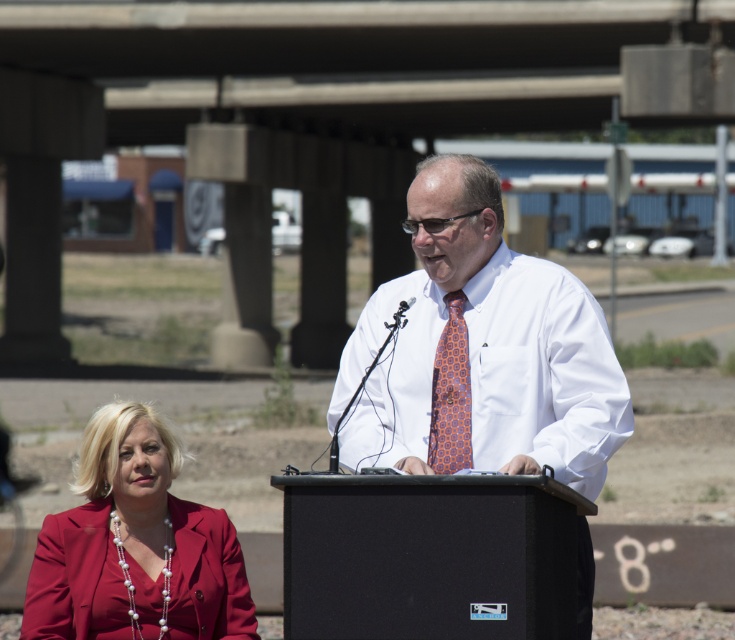
Question: Which is nearer to the concrete at center?

Choices:
 (A) black plastic speaker at center
 (B) orange hexagonal tie at center
 (C) white woven dress shirt at center
 (D) matte red blazer at lower left

Answer: (A)

Question: Estimate the real-world distances between objects in this image. Which object is farther from the concrete at center?

Choices:
 (A) white woven dress shirt at center
 (B) matte red blazer at lower left
 (C) black plastic speaker at center

Answer: (A)

Question: Is black plastic speaker at center below orange hexagonal tie at center?

Choices:
 (A) no
 (B) yes

Answer: (B)

Question: Does black plastic speaker at center appear on the right side of matte red blazer at lower left?

Choices:
 (A) no
 (B) yes

Answer: (B)

Question: Can you confirm if black plastic speaker at center is positioned to the right of orange hexagonal tie at center?

Choices:
 (A) no
 (B) yes

Answer: (B)

Question: Among these objects, which one is nearest to the camera?

Choices:
 (A) matte red blazer at lower left
 (B) orange hexagonal tie at center
 (C) black plastic speaker at center

Answer: (C)